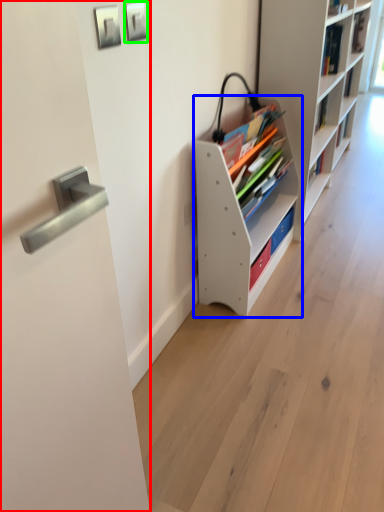
Question: Which is nearer to the door (highlighted by a red box)? shelf (highlighted by a blue box) or picture frame (highlighted by a green box).

Choices:
 (A) shelf
 (B) picture frame

Answer: (B)